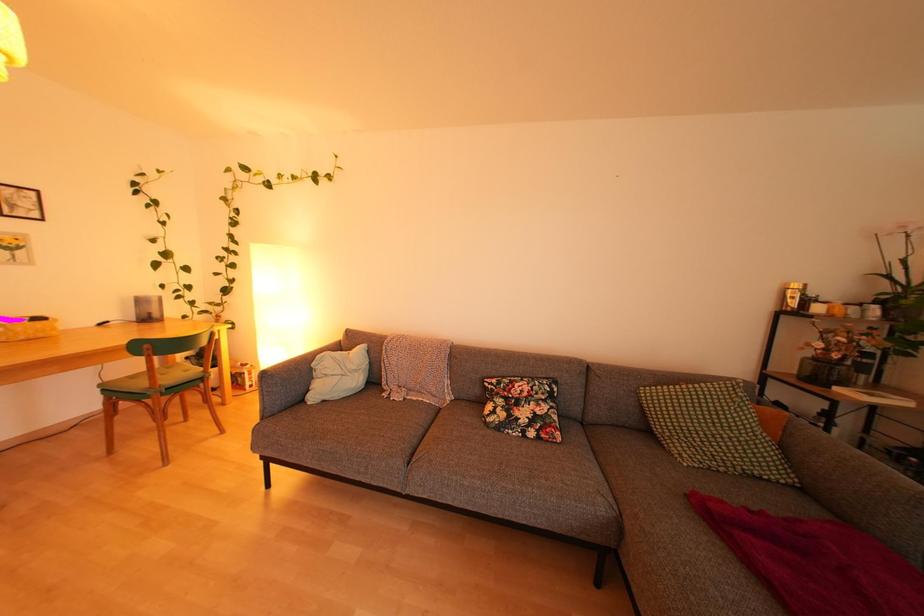
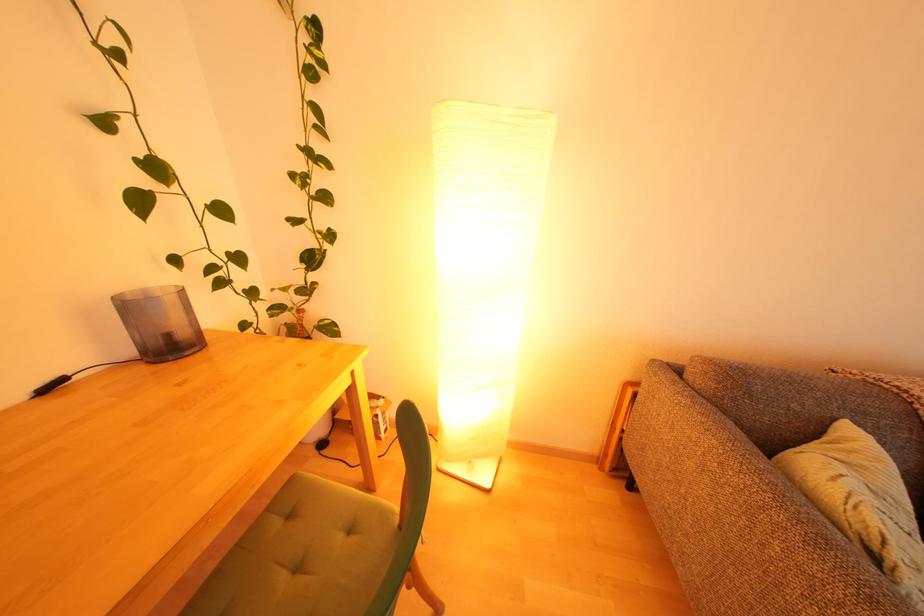
Which direction would the cameraman need to move to produce the second image?

The movement direction of the cameraman is left, forward.